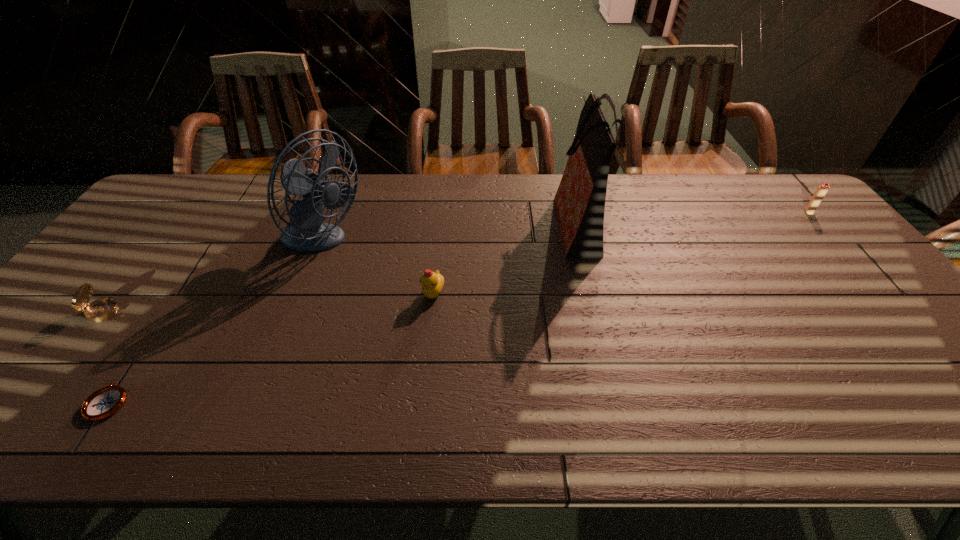
The height and width of the screenshot is (540, 960). In order to click on shopping bag in this screenshot , I will do `click(580, 199)`.

Where is `fan`? This screenshot has width=960, height=540. fan is located at coordinates (306, 232).

You are a GUI agent. You are given a task and a screenshot of the screen. Output one action in this format:
    pyautogui.click(x=<x>, y=<y>)
    Task: Click on the rightmost object
    The height and width of the screenshot is (540, 960).
    Given the screenshot: What is the action you would take?
    pyautogui.click(x=821, y=191)

The image size is (960, 540). I want to click on duckling, so click(432, 283).

Identify the location of the farther compass. (102, 309).

Locate an element on the screen. Image resolution: width=960 pixels, height=540 pixels. the taller compass is located at coordinates pyautogui.click(x=102, y=309).

Locate an element on the screen. The image size is (960, 540). the nearer compass is located at coordinates (103, 403).

Locate an element on the screen. the shorter compass is located at coordinates (103, 403).

What are the coordinates of `free location located on the front side of the second object from right to left` in the screenshot? It's located at (537, 222).

Find the location of a particular element. Image resolution: width=960 pixels, height=540 pixels. free space located on the front side of the second object from right to left is located at coordinates (508, 222).